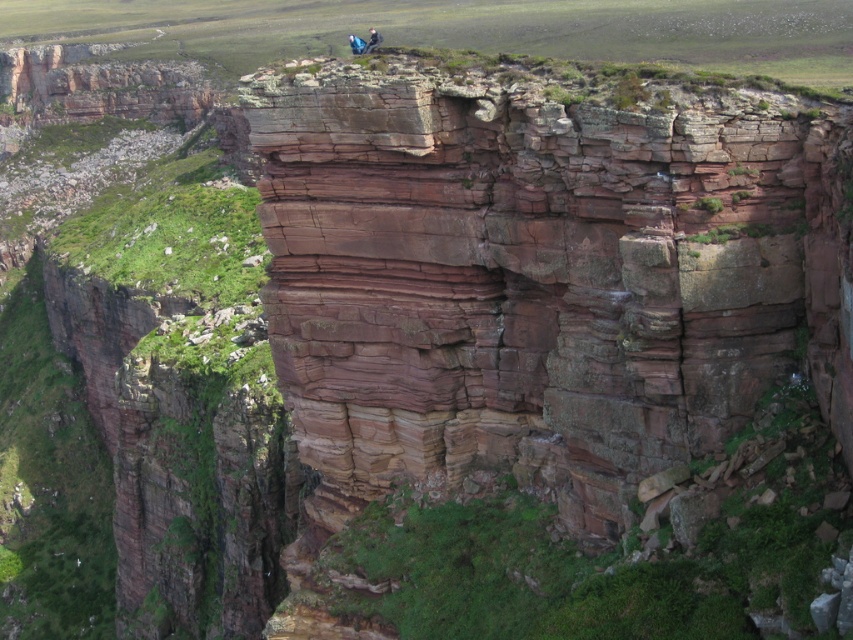
Question: Is dark blue fabric hiker at upper center bigger than blue fabric hiker at upper center?

Choices:
 (A) yes
 (B) no

Answer: (A)

Question: Observing the image, what is the correct spatial positioning of dark blue fabric hiker at upper center in reference to blue fabric hiker at upper center?

Choices:
 (A) right
 (B) left

Answer: (A)

Question: Does dark blue fabric hiker at upper center have a greater width compared to blue fabric hiker at upper center?

Choices:
 (A) yes
 (B) no

Answer: (B)